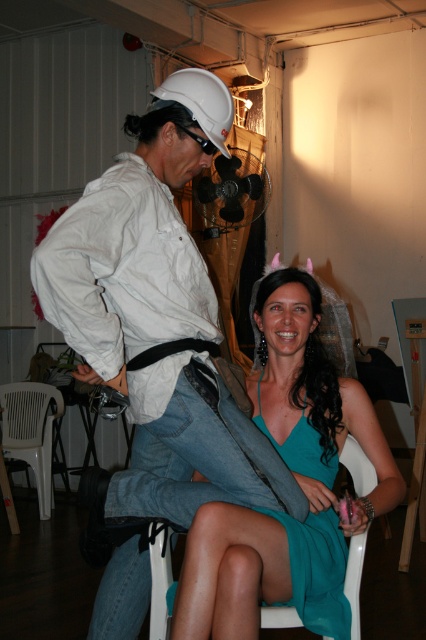
Question: Among these points, which one is nearest to the camera?

Choices:
 (A) (149, 544)
 (B) (299, 568)
 (C) (58, 404)

Answer: (B)

Question: Does white plastic chair at lower center have a smaller size compared to black plastic goggles at upper center?

Choices:
 (A) no
 (B) yes

Answer: (A)

Question: Can you confirm if teal satin dress at center is thinner than white plastic folding chair at lower left?

Choices:
 (A) yes
 (B) no

Answer: (B)

Question: Where is white matte hard hat at upper left located in relation to black plastic goggles at upper center in the image?

Choices:
 (A) above
 (B) below

Answer: (B)

Question: Which object is the closest to the black plastic goggles at upper center?

Choices:
 (A) white plastic folding chair at lower left
 (B) teal chiffon dress at center
 (C) white plastic chair at lower center

Answer: (B)

Question: Which point is farther from the camera taking this photo?

Choices:
 (A) (340, 618)
 (B) (149, 531)
 (C) (210, 147)
 (D) (117, 628)

Answer: (D)